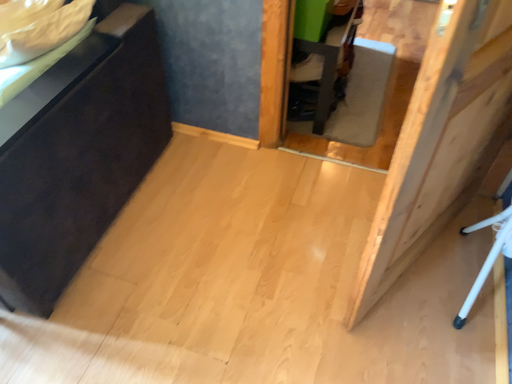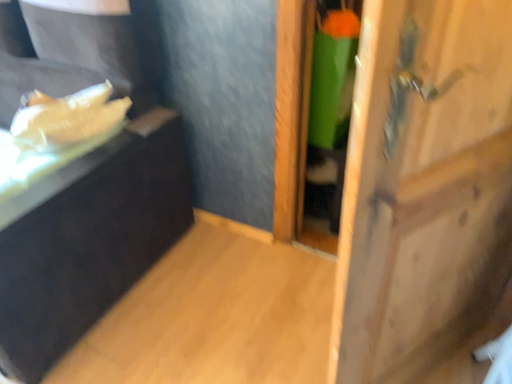
Question: How did the camera likely rotate when shooting the video?

Choices:
 (A) rotated right
 (B) rotated left

Answer: (B)